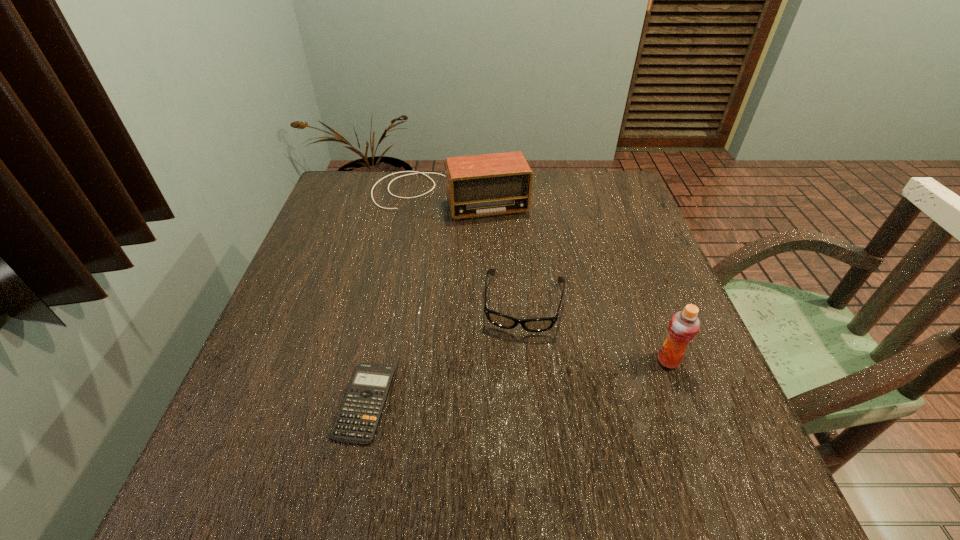
Locate an element on the screen. This screenshot has width=960, height=540. free space located 0.170m on the front-facing side of the second shortest object is located at coordinates (511, 408).

Locate an element on the screen. free space located on the front-facing side of the second shortest object is located at coordinates (509, 428).

Find the location of a particular element. object located in the far edge section of the desktop is located at coordinates (491, 184).

Find the location of a particular element. The width and height of the screenshot is (960, 540). object that is at the near edge is located at coordinates (357, 420).

Locate an element on the screen. The height and width of the screenshot is (540, 960). object that is at the left edge is located at coordinates (491, 184).

At what (x,y) coordinates should I click in order to perform the action: click on object that is at the right edge. Please return your answer as a coordinate pair (x, y). This screenshot has height=540, width=960. Looking at the image, I should click on (684, 325).

Locate an element on the screen. object that is positioned at the far left corner is located at coordinates (491, 184).

Find the location of a particular element. vacant space at the far edge of the desktop is located at coordinates (437, 181).

I want to click on vacant area at the near edge of the desktop, so click(636, 447).

Where is `free space at the left edge of the desktop`? This screenshot has width=960, height=540. free space at the left edge of the desktop is located at coordinates (326, 325).